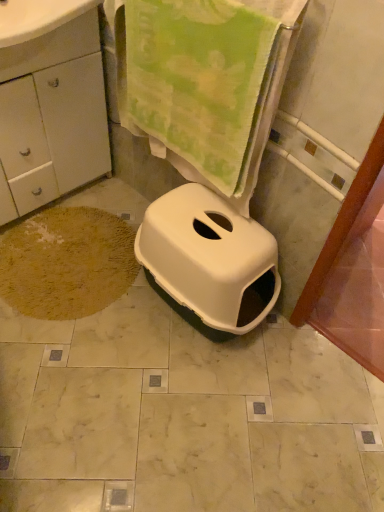
At what (x,y) coordinates should I click in order to perform the action: click on free space in front of brown shaggy rug at lower left. Please return your answer as a coordinate pair (x, y). Looking at the image, I should click on (75, 392).